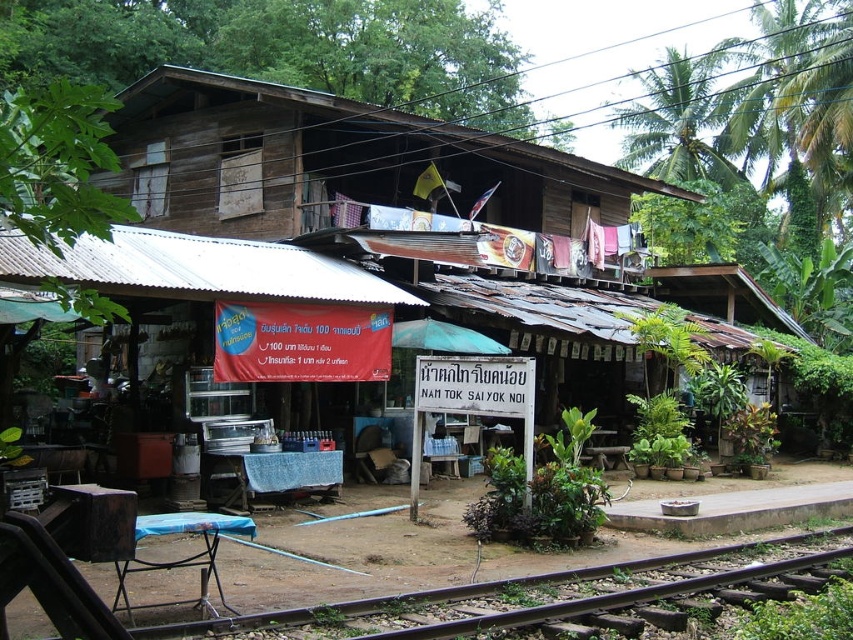
Question: Does wooden hut at center appear under brown wooden train track at lower center?

Choices:
 (A) no
 (B) yes

Answer: (A)

Question: Which of the following is the farthest from the observer?

Choices:
 (A) wooden hut at center
 (B) brown wooden train track at lower center

Answer: (A)

Question: Does wooden hut at center appear on the left side of brown wooden train track at lower center?

Choices:
 (A) yes
 (B) no

Answer: (A)

Question: Which object is farther from the camera taking this photo?

Choices:
 (A) brown wooden train track at lower center
 (B) wooden hut at center

Answer: (B)

Question: Is wooden hut at center smaller than brown wooden train track at lower center?

Choices:
 (A) yes
 (B) no

Answer: (B)